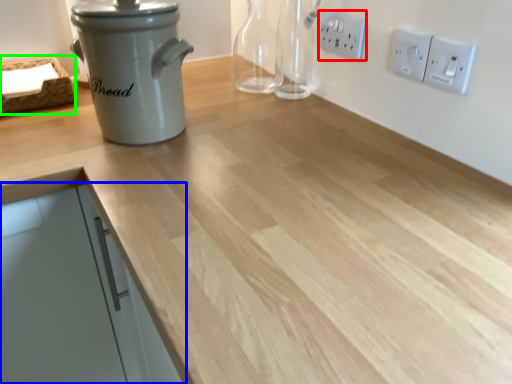
Question: Based on their relative distances, which object is nearer to electric outlet (highlighted by a red box)? Choose from cabinetry (highlighted by a blue box) and basket (highlighted by a green box).

Choices:
 (A) cabinetry
 (B) basket

Answer: (B)